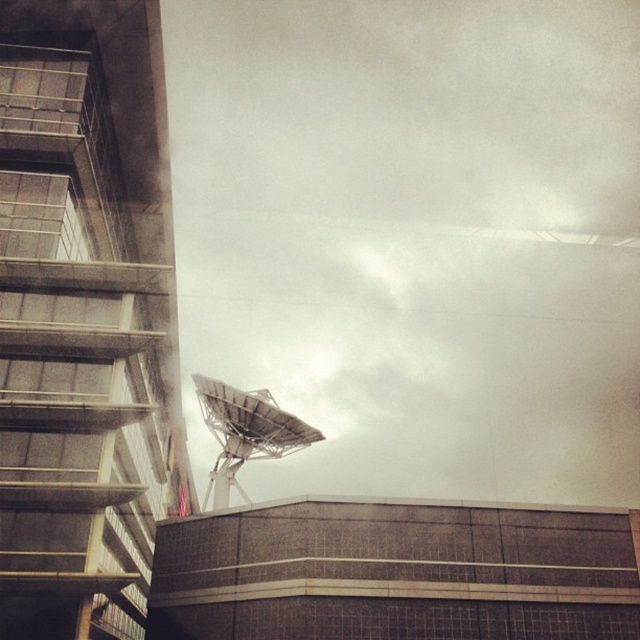
Question: Can you confirm if white matte satellite dish at center is positioned above metallic satellite dish at lower center?

Choices:
 (A) no
 (B) yes

Answer: (B)

Question: Which point is closer to the camera?

Choices:
 (A) metallic satellite dish at lower center
 (B) white matte satellite dish at center

Answer: (A)

Question: Which object appears farthest from the camera in this image?

Choices:
 (A) white matte satellite dish at center
 (B) metallic satellite dish at lower center

Answer: (A)

Question: Can you confirm if white matte satellite dish at center is thinner than metallic satellite dish at lower center?

Choices:
 (A) yes
 (B) no

Answer: (B)

Question: Is white matte satellite dish at center bigger than metallic satellite dish at lower center?

Choices:
 (A) no
 (B) yes

Answer: (B)

Question: Which point is closer to the camera?

Choices:
 (A) pos(442,200)
 (B) pos(230,477)

Answer: (B)